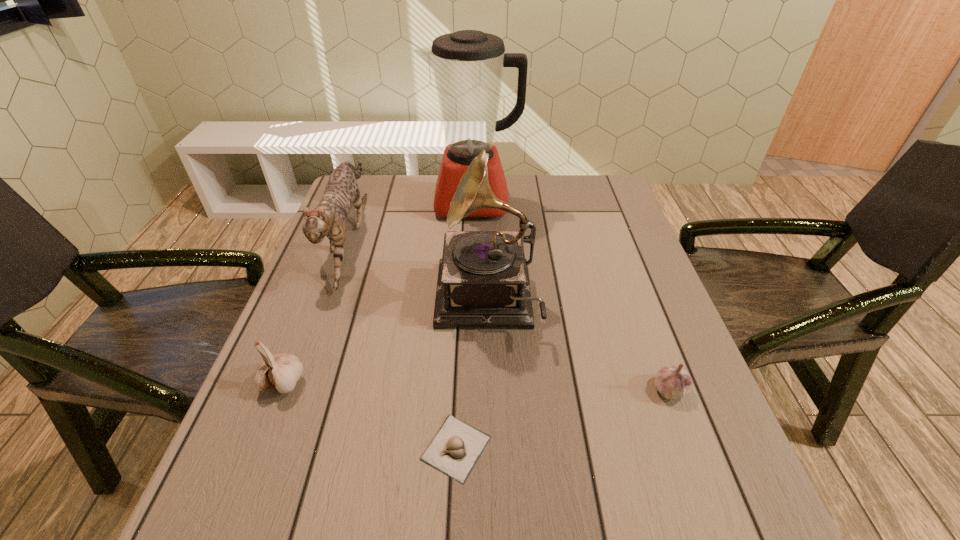
You are a GUI agent. You are given a task and a screenshot of the screen. Output one action in this format:
    pyautogui.click(x=<x>, y=<y>)
    Task: Click on the vacant area situated 0.220m on the horn of the fifth shortest object
    The image size is (960, 540).
    Given the screenshot: What is the action you would take?
    pyautogui.click(x=343, y=302)

At what (x,y) coordinates should I click in order to perform the action: click on vacant space located on the horn of the fifth shortest object. Please return your answer as a coordinate pair (x, y). Looking at the image, I should click on (364, 302).

Image resolution: width=960 pixels, height=540 pixels. What are the coordinates of `blank space located 0.310m on the horn of the fifth shortest object` in the screenshot? It's located at (304, 302).

The height and width of the screenshot is (540, 960). What are the coordinates of `vacant space located 0.210m on the face of the fourth shortest object` in the screenshot? It's located at (300, 369).

Find the location of a particular element. The height and width of the screenshot is (540, 960). vacant space located 0.320m on the right of the leftmost garlic is located at coordinates (468, 382).

Where is `vacant point located on the left of the rightmost object`? The image size is (960, 540). vacant point located on the left of the rightmost object is located at coordinates (503, 389).

Locate an element on the screen. free spot located 0.140m on the back of the nearest garlic is located at coordinates (x=460, y=355).

This screenshot has width=960, height=540. In order to click on blender that is at the far edge in this screenshot , I will do `click(468, 65)`.

This screenshot has height=540, width=960. In order to click on cat present at the far edge in this screenshot , I will do `click(328, 219)`.

Locate an element on the screen. The width and height of the screenshot is (960, 540). cat located in the left edge section of the desktop is located at coordinates (328, 219).